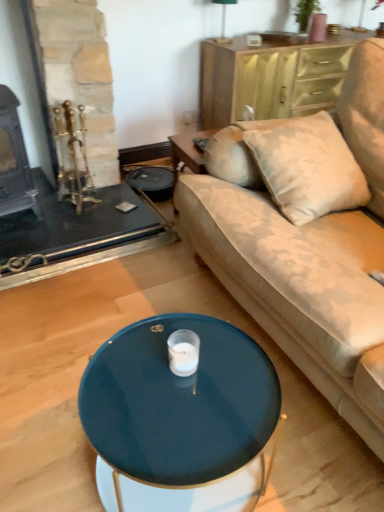
Describe the element at coordinates (306, 237) in the screenshot. Image resolution: width=384 pixels, height=512 pixels. I see `velvet beige couch at center` at that location.

This screenshot has width=384, height=512. Identify the location of green fabric lampshade at upper center. (223, 21).

Which is in front, point (96, 433) or point (272, 234)?

Point (96, 433)

From a real-world perspective, is glossy dark blue coffee table at center under velvet beige couch at center?

Yes, from a real-world perspective, glossy dark blue coffee table at center is below velvet beige couch at center.

Is glossy dark blue coffee table at center to the left of velvet beige couch at center from the viewer's perspective?

Correct, you'll find glossy dark blue coffee table at center to the left of velvet beige couch at center.

Is glossy dark blue coffee table at center aimed at velvet beige couch at center?

Yes, glossy dark blue coffee table at center is turned towards velvet beige couch at center.

Who is smaller, wooden dresser at upper right or glossy dark blue coffee table at center?

Smaller between the two is glossy dark blue coffee table at center.

From a real-world perspective, who is located higher, wooden dresser at upper right or glossy dark blue coffee table at center?

wooden dresser at upper right.

Looking at this image, is wooden dresser at upper right positioned with its back to glossy dark blue coffee table at center?

No, wooden dresser at upper right is not facing away from glossy dark blue coffee table at center.

Consider the image. Would you say wooden dresser at upper right is to the left or to the right of glossy dark blue coffee table at center in the picture?

From the image, it's evident that wooden dresser at upper right is to the right of glossy dark blue coffee table at center.

Does point (223, 38) come closer to viewer compared to point (370, 39)?

That is False.

Is green fabric lampshade at upper center looking in the opposite direction of velvet beige couch at center?

No, green fabric lampshade at upper center is not facing away from velvet beige couch at center.

Considering the relative sizes of green fabric lampshade at upper center and velvet beige couch at center in the image provided, is green fabric lampshade at upper center shorter than velvet beige couch at center?

Indeed, green fabric lampshade at upper center has a lesser height compared to velvet beige couch at center.

From the image's perspective, between green fabric lampshade at upper center and velvet beige couch at center, who is located below?

velvet beige couch at center is shown below in the image.

Who is shorter, velvet beige couch at center or glossy dark blue coffee table at center?

glossy dark blue coffee table at center is shorter.

From the image's perspective, is velvet beige couch at center below glossy dark blue coffee table at center?

No, from the image's perspective, velvet beige couch at center is not beneath glossy dark blue coffee table at center.

Considering the relative sizes of velvet beige couch at center and glossy dark blue coffee table at center in the image provided, is velvet beige couch at center smaller than glossy dark blue coffee table at center?

No, velvet beige couch at center is not smaller than glossy dark blue coffee table at center.

Consider the image. Measure the distance between velvet beige couch at center and glossy dark blue coffee table at center.

A distance of 20.95 inches exists between velvet beige couch at center and glossy dark blue coffee table at center.

Which of these two, velvet beige couch at center or wooden dresser at upper right, is thinner?

wooden dresser at upper right is thinner.

Is point (231, 221) positioned after point (266, 73)?

No, (231, 221) is in front of (266, 73).

Is velvet beige couch at center placed right next to wooden dresser at upper right?

No, velvet beige couch at center is not touching wooden dresser at upper right.

From the image's perspective, is velvet beige couch at center on top of wooden dresser at upper right?

No, from the image's perspective, velvet beige couch at center is not above wooden dresser at upper right.

Do you think wooden dresser at upper right is within velvet beige couch at center, or outside of it?

The correct answer is: outside.

Does wooden dresser at upper right lie in front of velvet beige couch at center?

No, it is behind velvet beige couch at center.

From a real-world perspective, is wooden dresser at upper right positioned over velvet beige couch at center based on gravity?

Incorrect, from a real-world perspective, wooden dresser at upper right is lower than velvet beige couch at center.

Can you confirm if glossy dark blue coffee table at center is taller than wooden dresser at upper right?

In fact, glossy dark blue coffee table at center may be shorter than wooden dresser at upper right.

Looking at the image, does glossy dark blue coffee table at center seem bigger or smaller compared to wooden dresser at upper right?

Considering their sizes, glossy dark blue coffee table at center takes up less space than wooden dresser at upper right.

Is glossy dark blue coffee table at center next to wooden dresser at upper right?

No, glossy dark blue coffee table at center is not with wooden dresser at upper right.

Choose the correct answer: Is glossy dark blue coffee table at center inside wooden dresser at upper right or outside it?

glossy dark blue coffee table at center is not inside wooden dresser at upper right, it's outside.

Image resolution: width=384 pixels, height=512 pixels. What are the coordinates of `coffee table located behind the velvet beige couch at center` in the screenshot? It's located at (180, 417).

Where is `dresser above the glossy dark blue coffee table at center (from a real-world perspective)`? The width and height of the screenshot is (384, 512). dresser above the glossy dark blue coffee table at center (from a real-world perspective) is located at coordinates (271, 78).

Based on their spatial positions, is wooden dresser at upper right or velvet beige couch at center closer to glossy dark blue coffee table at center?

Based on the image, velvet beige couch at center appears to be nearer to glossy dark blue coffee table at center.

Estimate the real-world distances between objects in this image. Which object is further from green fabric lampshade at upper center, velvet beige couch at center or glossy dark blue coffee table at center?

glossy dark blue coffee table at center lies further to green fabric lampshade at upper center than the other object.

When comparing their distances from glossy dark blue coffee table at center, does velvet beige couch at center or wooden dresser at upper right seem further?

wooden dresser at upper right lies further to glossy dark blue coffee table at center than the other object.

Based on the photo, looking at the image, which one is located further to wooden dresser at upper right, glossy dark blue coffee table at center or velvet beige couch at center?

glossy dark blue coffee table at center is positioned further to the anchor wooden dresser at upper right.

Which object lies further to the anchor point glossy dark blue coffee table at center, green fabric lampshade at upper center or velvet beige couch at center?

The object further to glossy dark blue coffee table at center is green fabric lampshade at upper center.

Based on their spatial positions, is wooden dresser at upper right or green fabric lampshade at upper center further from velvet beige couch at center?

green fabric lampshade at upper center lies further to velvet beige couch at center than the other object.

Considering their positions, is glossy dark blue coffee table at center positioned closer to green fabric lampshade at upper center than wooden dresser at upper right?

wooden dresser at upper right.

Considering their positions, is wooden dresser at upper right positioned closer to velvet beige couch at center than glossy dark blue coffee table at center?

glossy dark blue coffee table at center.

This screenshot has width=384, height=512. What are the coordinates of `dresser between green fabric lampshade at upper center and glossy dark blue coffee table at center in the up-down direction` in the screenshot? It's located at (271, 78).

Locate an element on the screen. The width and height of the screenshot is (384, 512). dresser between velvet beige couch at center and green fabric lampshade at upper center from front to back is located at coordinates (271, 78).

In order to click on coffee table between velvet beige couch at center and wooden dresser at upper right from front to back in this screenshot , I will do `click(180, 417)`.

Image resolution: width=384 pixels, height=512 pixels. Identify the location of coffee table located between velvet beige couch at center and green fabric lampshade at upper center in the depth direction. [180, 417].